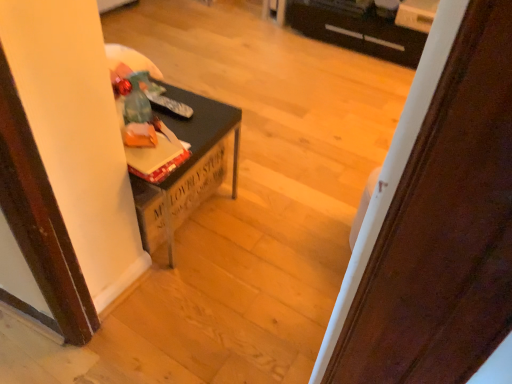
Locate an element on the screen. The image size is (512, 384). vacant area that is in front of matte black table at left is located at coordinates (181, 297).